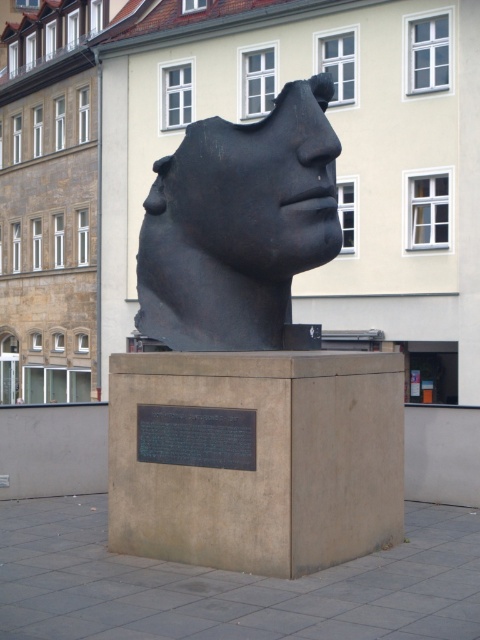
You are an art student trying to sketch the sculpture in the public square. You notice two objects labeled as the black matte head at center and the black matte sculpture at center. Which one has a greater width?

The black matte head at center has a greater width than the black matte sculpture at center according to the description.

You are standing in the public square facing the sculpture. There are two points marked on the sculpture. Which point, point at coordinate [180,426] or point at coordinate [254,264], is closer to you?

Point at coordinate [180,426] is closer to you than point at coordinate [254,264].